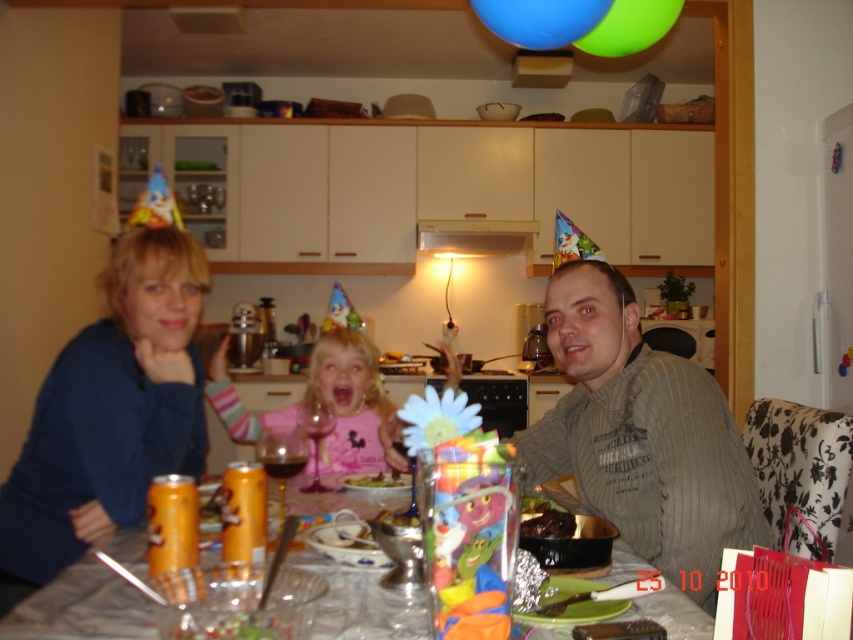
Based on the photo, who is positioned more to the right, blue fleece sweater at left or translucent plastic bowl at center?

From the viewer's perspective, translucent plastic bowl at center appears more on the right side.

Does blue fleece sweater at left have a smaller size compared to translucent plastic bowl at center?

No.

Which is in front, point (102, 460) or point (296, 564)?

Positioned in front is point (296, 564).

This screenshot has width=853, height=640. I want to click on blue fleece sweater at left, so click(x=109, y=412).

Which is behind, point (67, 436) or point (646, 481)?

The point (67, 436) is more distant.

Locate an element on the screen. This screenshot has height=640, width=853. blue fleece sweater at left is located at coordinates (109, 412).

Can you confirm if gray striped shirt at center is taller than translucent plastic bowl at center?

Indeed, gray striped shirt at center has a greater height compared to translucent plastic bowl at center.

Which is more to the right, gray striped shirt at center or translucent plastic bowl at center?

From the viewer's perspective, gray striped shirt at center appears more on the right side.

This screenshot has height=640, width=853. Identify the location of gray striped shirt at center. (641, 435).

You are a GUI agent. You are given a task and a screenshot of the screen. Output one action in this format:
    pyautogui.click(x=<x>, y=<y>)
    Task: Click on the gray striped shirt at center
    The image size is (853, 640).
    Given the screenshot: What is the action you would take?
    pyautogui.click(x=641, y=435)